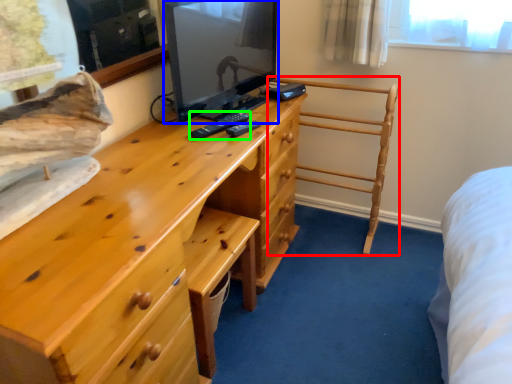
Question: Which is farther away from furniture (highlighted by a red box)? television (highlighted by a blue box) or remote (highlighted by a green box)?

Choices:
 (A) television
 (B) remote

Answer: (B)